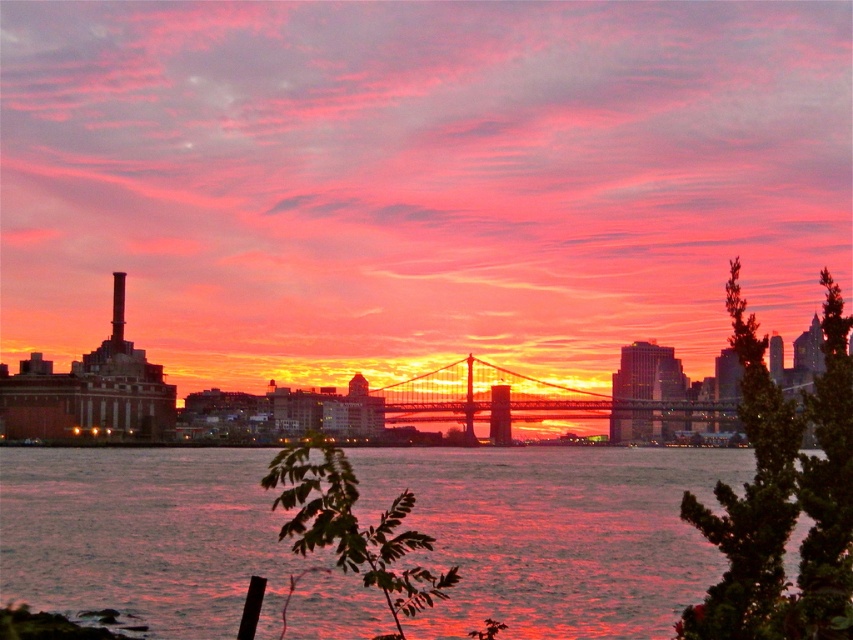
Based on the photo, you are standing at the edge of the river and see the point marked as point (556, 532). What is the nature of the surface at that point?

The surface at point (556, 532) is shiny metallic water at center, which reflects the vibrant sunset colors in the sky.

You are an architect designing a new observation deck. You want to ensure visitors can see both the shiny metallic water at center and the metallic bridge at center. Based on their positions, which object should be placed closer to the left side of the deck?

The shiny metallic water at center should be placed closer to the left side of the deck because it is positioned on the left side of the metallic bridge at center.